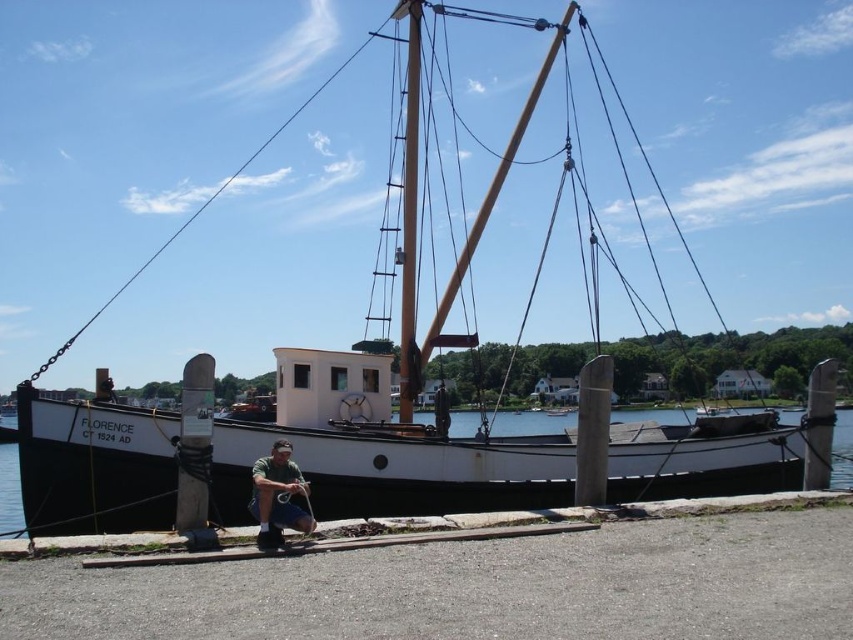
Question: Is wooden mast at center thinner than green matte shirt at lower center?

Choices:
 (A) no
 (B) yes

Answer: (A)

Question: Which object is closer to the camera taking this photo?

Choices:
 (A) wooden mast at center
 (B) green matte shirt at lower center
 (C) white matte water at center

Answer: (B)

Question: Which object is positioned farthest from the wooden mast at center?

Choices:
 (A) green matte shirt at lower center
 (B) white matte water at center

Answer: (B)

Question: Estimate the real-world distances between objects in this image. Which object is farther from the white matte water at center?

Choices:
 (A) wooden mast at center
 (B) green matte shirt at lower center

Answer: (A)

Question: Is the position of white matte water at center less distant than that of green matte shirt at lower center?

Choices:
 (A) no
 (B) yes

Answer: (A)

Question: From the image, what is the correct spatial relationship of wooden mast at center in relation to white matte water at center?

Choices:
 (A) right
 (B) left

Answer: (B)